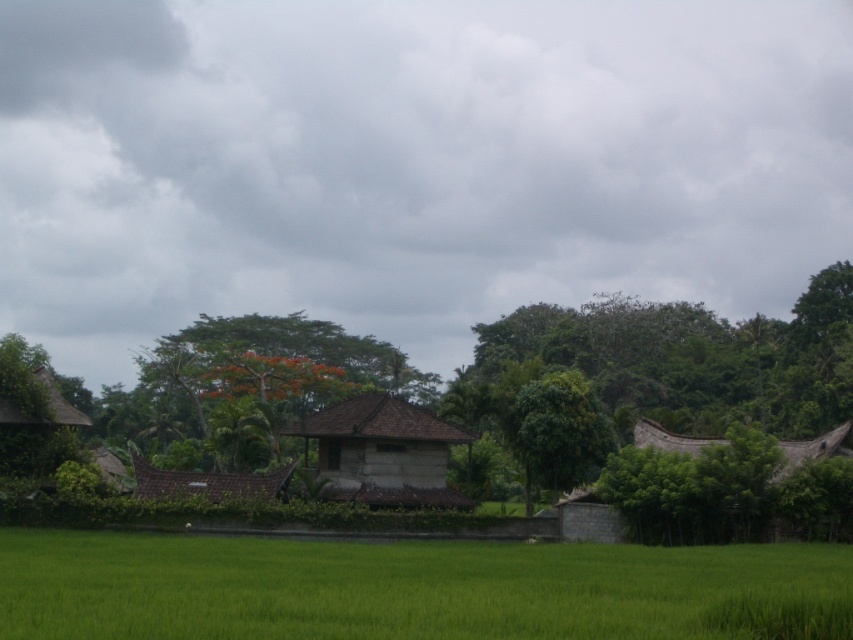
You are a farmer planning to plant crops in the green grassy rice field at lower left and the brown tile hut at center. Which area has more space available for planting?

The green grassy rice field at lower left has more space available for planting because it is larger in size than the brown tile hut at center.

You are standing at point (839, 452) and want to walk to point (341, 401). Is the destination visible from your current position?

Point (341, 401) is behind point (839, 452), so the destination is not visible from your current position.